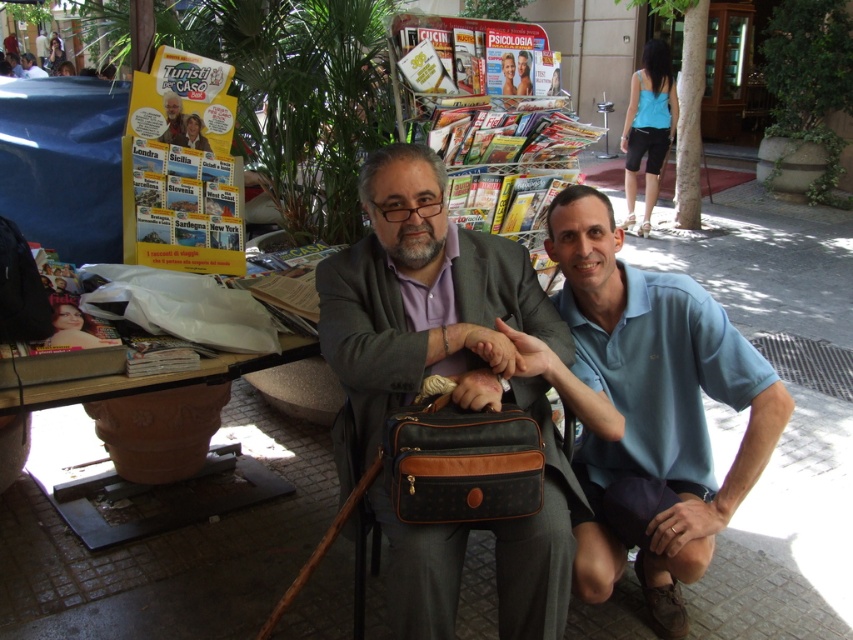
Which is more to the right, blue cotton shirt at lower right or matte black jacket at center?

blue cotton shirt at lower right is more to the right.

Which of these two, blue cotton shirt at lower right or matte black jacket at center, stands taller?

Standing taller between the two is blue cotton shirt at lower right.

Is point (675, 600) farther from camera compared to point (173, 140)?

No, (675, 600) is in front of (173, 140).

At what (x,y) coordinates should I click in order to perform the action: click on blue cotton shirt at lower right. Please return your answer as a coordinate pair (x, y). The height and width of the screenshot is (640, 853). Looking at the image, I should click on (648, 410).

Does blue cotton shirt at lower right have a greater width compared to brown textured briefcase at center?

Yes, blue cotton shirt at lower right is wider than brown textured briefcase at center.

Does blue cotton shirt at lower right come behind brown textured briefcase at center?

Yes, it is behind brown textured briefcase at center.

Where is `blue cotton shirt at lower right`? The width and height of the screenshot is (853, 640). blue cotton shirt at lower right is located at coordinates (648, 410).

This screenshot has height=640, width=853. Find the location of `blue cotton shirt at lower right`. blue cotton shirt at lower right is located at coordinates (648, 410).

Can you confirm if leather bag at center is taller than matte black bag at center?

Yes, leather bag at center is taller than matte black bag at center.

Image resolution: width=853 pixels, height=640 pixels. What are the coordinates of `leather bag at center` in the screenshot? It's located at (451, 388).